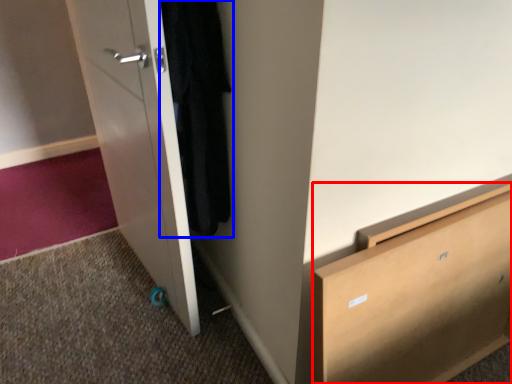
Question: Which object is closer to the camera taking this photo, chest of drawers (highlighted by a red box) or clothing (highlighted by a blue box)?

Choices:
 (A) chest of drawers
 (B) clothing

Answer: (A)